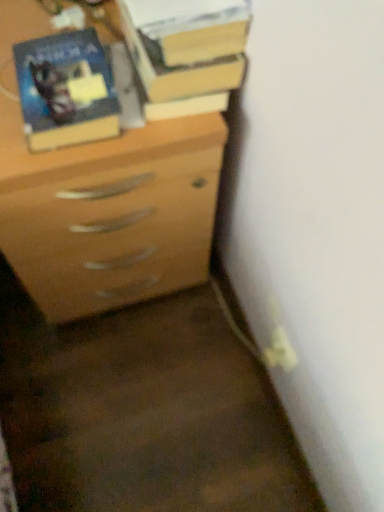
Question: Does hardcover book at upper center have a lesser height compared to matte wood chest of drawers at center?

Choices:
 (A) yes
 (B) no

Answer: (A)

Question: From the image's perspective, does hardcover book at upper center appear higher than matte wood chest of drawers at center?

Choices:
 (A) no
 (B) yes

Answer: (B)

Question: Is hardcover book at upper center in contact with matte wood chest of drawers at center?

Choices:
 (A) yes
 (B) no

Answer: (B)

Question: Is hardcover book at upper center to the right of matte wood chest of drawers at center from the viewer's perspective?

Choices:
 (A) no
 (B) yes

Answer: (B)

Question: Is hardcover book at upper center wider than matte wood chest of drawers at center?

Choices:
 (A) yes
 (B) no

Answer: (B)

Question: From a real-world perspective, is hardcover book at upper center positioned over matte wood chest of drawers at center based on gravity?

Choices:
 (A) no
 (B) yes

Answer: (B)

Question: Can you confirm if matte black book at upper left is bigger than hardcover book at upper center?

Choices:
 (A) no
 (B) yes

Answer: (A)

Question: Is matte black book at upper left smaller than hardcover book at upper center?

Choices:
 (A) no
 (B) yes

Answer: (B)

Question: Does matte black book at upper left have a greater height compared to hardcover book at upper center?

Choices:
 (A) yes
 (B) no

Answer: (A)

Question: From a real-world perspective, is matte black book at upper left on top of hardcover book at upper center?

Choices:
 (A) no
 (B) yes

Answer: (A)

Question: From a real-world perspective, is matte black book at upper left located beneath hardcover book at upper center?

Choices:
 (A) yes
 (B) no

Answer: (A)

Question: Considering the relative sizes of matte black book at upper left and hardcover book at upper center in the image provided, is matte black book at upper left wider than hardcover book at upper center?

Choices:
 (A) no
 (B) yes

Answer: (A)

Question: From a real-world perspective, is matte wood chest of drawers at center positioned over hardcover book at upper center based on gravity?

Choices:
 (A) no
 (B) yes

Answer: (A)